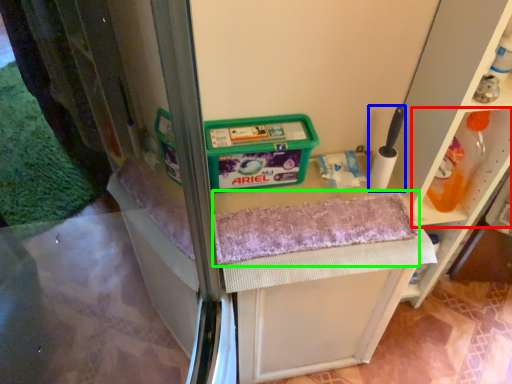
Question: Which object is the farthest from shelf (highlighted by a red box)? Choose among these: brush (highlighted by a blue box) or bath towel (highlighted by a green box).

Choices:
 (A) brush
 (B) bath towel

Answer: (B)